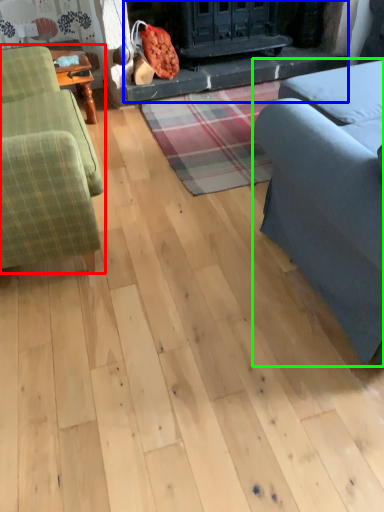
Question: Based on their relative distances, which object is nearer to studio couch (highlighted by a red box)? Choose from fireplace (highlighted by a blue box) and studio couch (highlighted by a green box).

Choices:
 (A) fireplace
 (B) studio couch

Answer: (B)